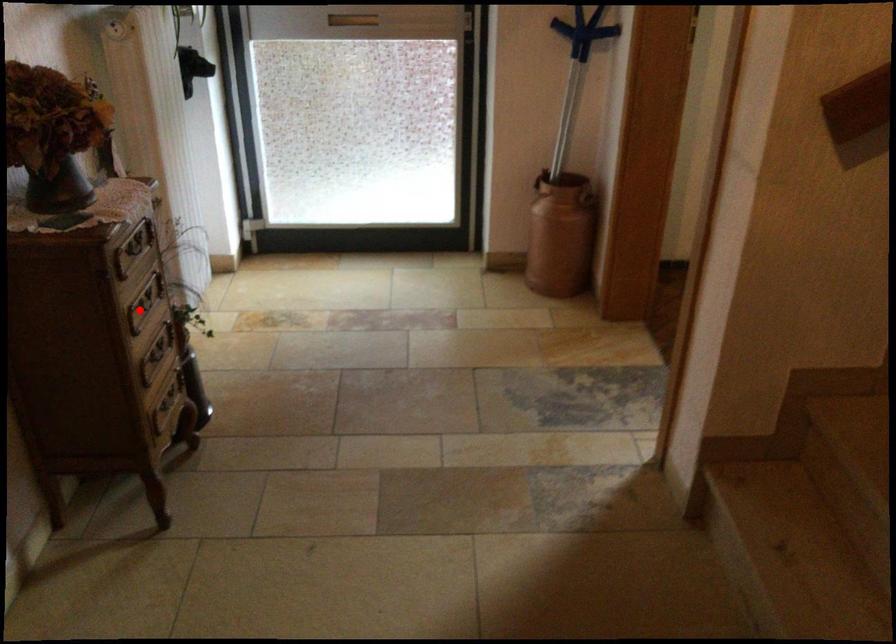
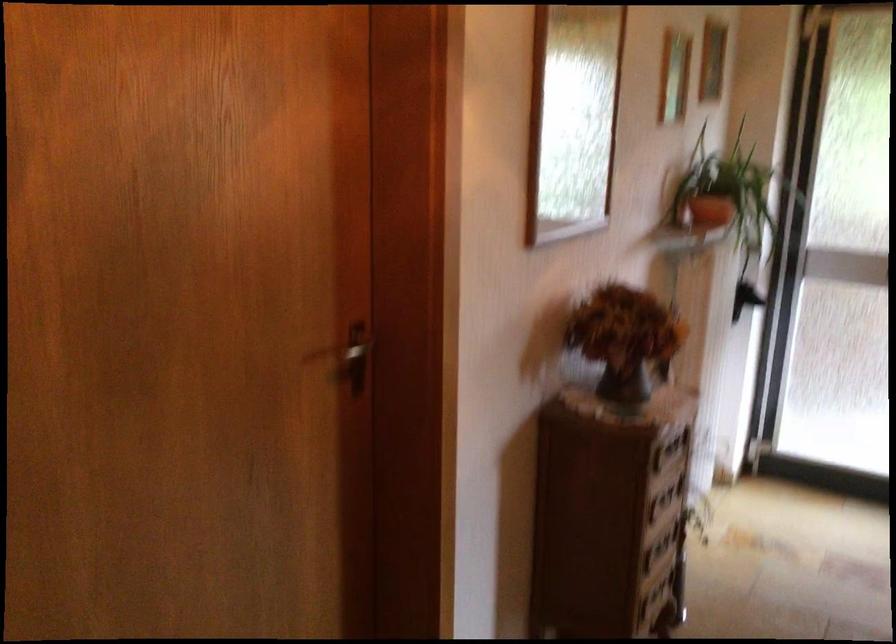
Question: I am providing you with two images of the same scene from different viewpoints. In image1, a red point is highlighted. Considering the same 3D point in image2, which of the following is correct?

Choices:
 (A) It is closer
 (B) It is farther

Answer: (B)